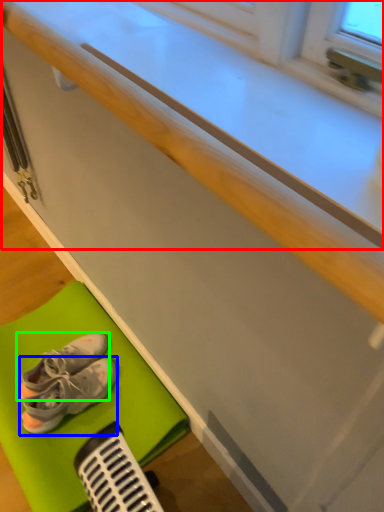
Question: Considering the real-world distances, which object is closest to counter top (highlighted by a red box)? footwear (highlighted by a blue box) or footwear (highlighted by a green box).

Choices:
 (A) footwear
 (B) footwear

Answer: (A)